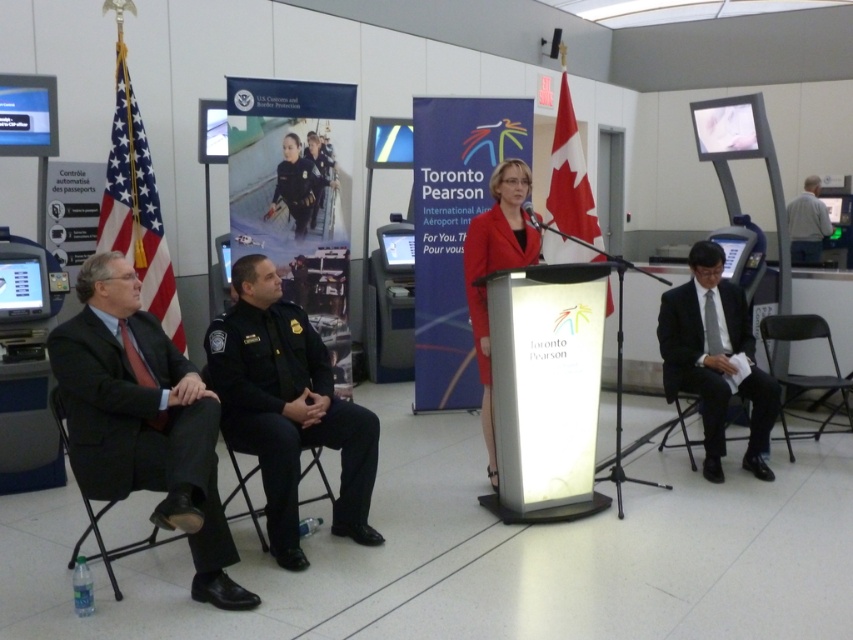
You are attending a formal event at Toronto Pearson International Airport and see a woman speaking into a microphone behind a podium. There are two people seated nearby. Which of the two seated individuals is positioned closer to the podium? The options are the dark suit at left and the black uniform at center.

The dark suit at left is positioned closer to the podium because it is to the left of the black uniform at center, and the podium is in the foreground with the woman speaking into it.

You are an event organizer at Toronto Pearson Airport and need to ensure proper seating arrangements. You notice the black uniform at center and the black fabric chair at left. Which object is positioned higher in the image?

The black uniform at center is above the black fabric chair at left, so the black uniform at center is positioned higher in the image.

You are standing at the entrance of the terminal and want to locate the black uniform at center. Based on the coordinates provided, in which direction should you look to find it?

The black uniform at center is located at coordinates point [287,406], so you should look towards the center of the terminal area to find it.